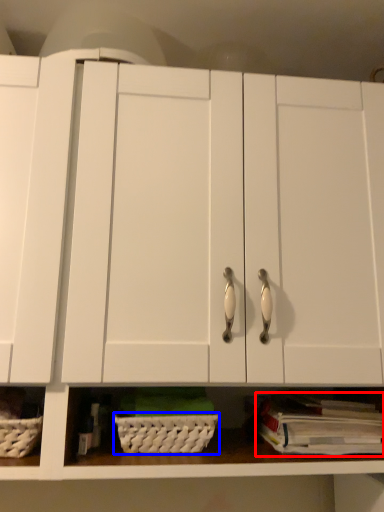
Question: Which object is closer to the camera taking this photo, book (highlighted by a red box) or basket (highlighted by a blue box)?

Choices:
 (A) book
 (B) basket

Answer: (A)